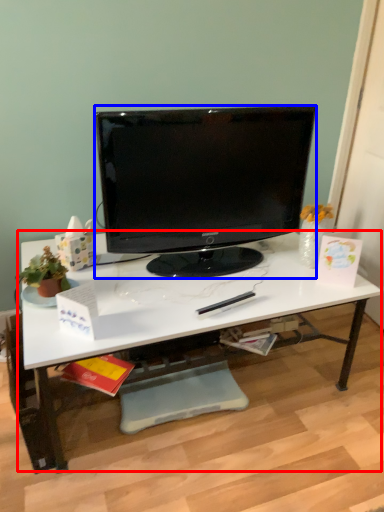
Question: Which object appears farthest to the camera in this image, desk (highlighted by a red box) or computer monitor (highlighted by a blue box)?

Choices:
 (A) desk
 (B) computer monitor

Answer: (B)